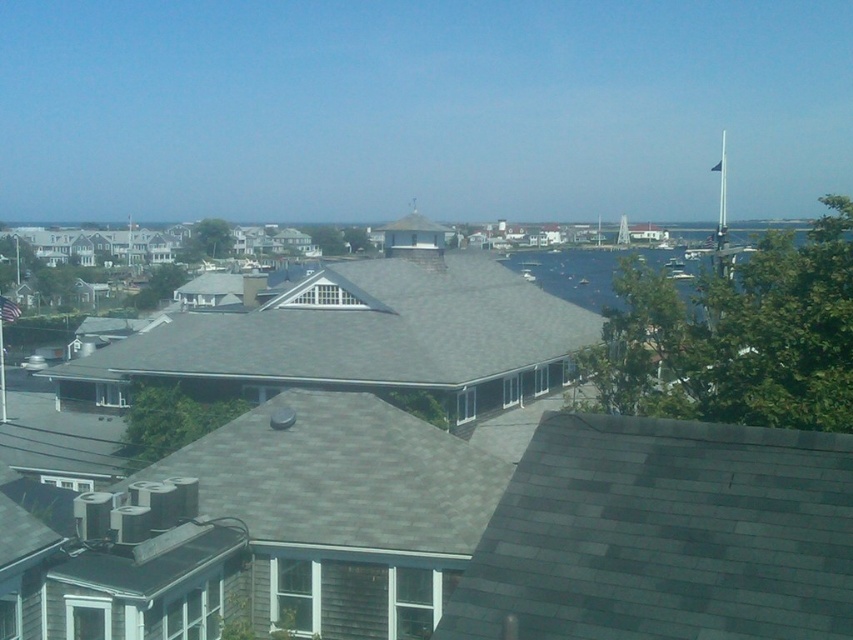
You are standing in the coastal town and want to take a photo of the gray shingles at center without the dark blue water at right appearing in the background. Is this possible based on their positions?

The dark blue water at right is behind the gray shingles at center, so if you position yourself in front of the gray shingles at center, the water will not be visible in the background. Therefore, it is possible to take such a photo.

You are standing in the coastal town and want to walk from the gray shingles at center to the dark blue water at right. Which direction should you head?

Since the gray shingles at center is positioned on the left side of dark blue water at right, you should head to the right to reach the dark blue water at right from the gray shingles at center.